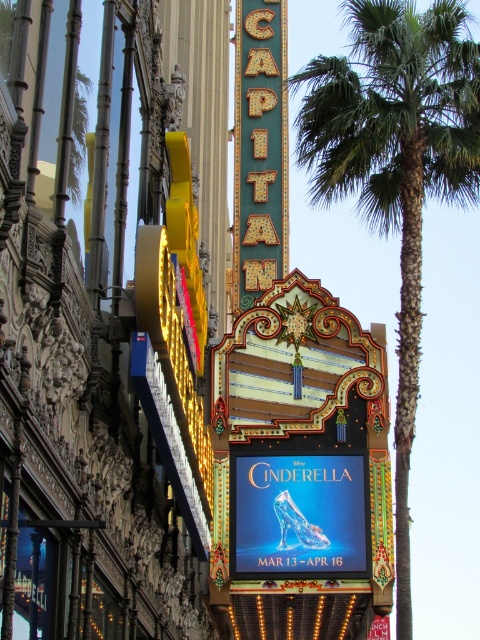
What is the object located at the coordinates point (396, 166) on the theater marquee?

The point (396, 166) marks the green leafy palm tree at center.

What is the color of the object located at point (260, 148)?

The point (260, 148) indicates a gold metallic sign at center, so the color is gold.

You are an event planner setting up a photo backdrop for the theater marquee. You need to place a spotlight exactly at the center of the gold metallic sign at center. According to the coordinates provided, where should you aim the spotlight?

The gold metallic sign at center is located at coordinates point (x=260, y=148), so you should aim the spotlight at that exact point to center it properly.